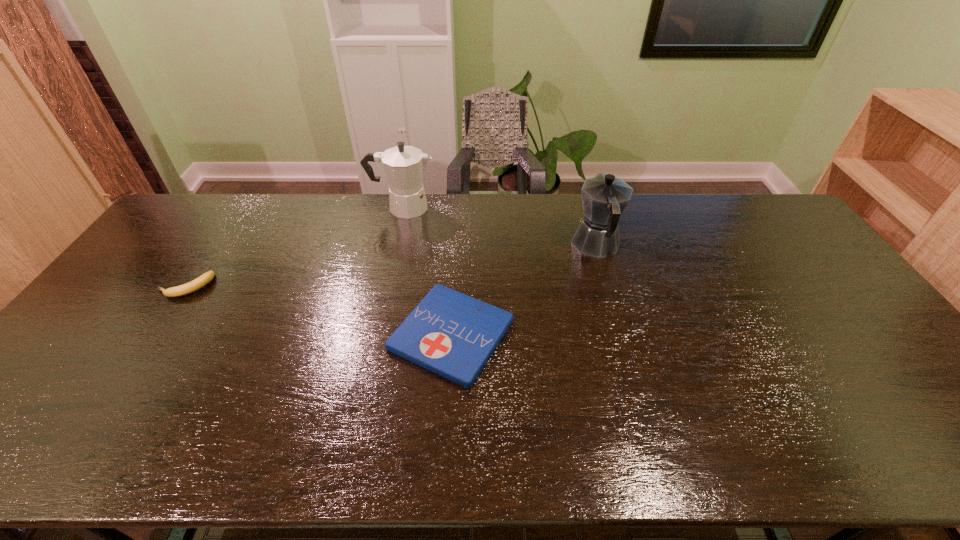
I want to click on blank area in the image that satisfies the following two spatial constraints: 1. at the spout of the rightmost object; 2. at the spout of the farther coffeepot, so click(586, 207).

Find the location of `free location that satisfies the following two spatial constraints: 1. at the spout of the shortest object; 2. on the left side of the farther coffeepot`. free location that satisfies the following two spatial constraints: 1. at the spout of the shortest object; 2. on the left side of the farther coffeepot is located at coordinates (375, 335).

You are a GUI agent. You are given a task and a screenshot of the screen. Output one action in this format:
    pyautogui.click(x=<x>, y=<y>)
    Task: Click on the free location that satisfies the following two spatial constraints: 1. at the spout of the left coffeepot; 2. at the spout of the second farthest object
    Image resolution: width=960 pixels, height=540 pixels.
    Given the screenshot: What is the action you would take?
    pyautogui.click(x=395, y=245)

You are a GUI agent. You are given a task and a screenshot of the screen. Output one action in this format:
    pyautogui.click(x=<x>, y=<y>)
    Task: Click on the free location that satisfies the following two spatial constraints: 1. at the spout of the farthest object; 2. on the front side of the leftmost object
    
    Given the screenshot: What is the action you would take?
    pyautogui.click(x=386, y=286)